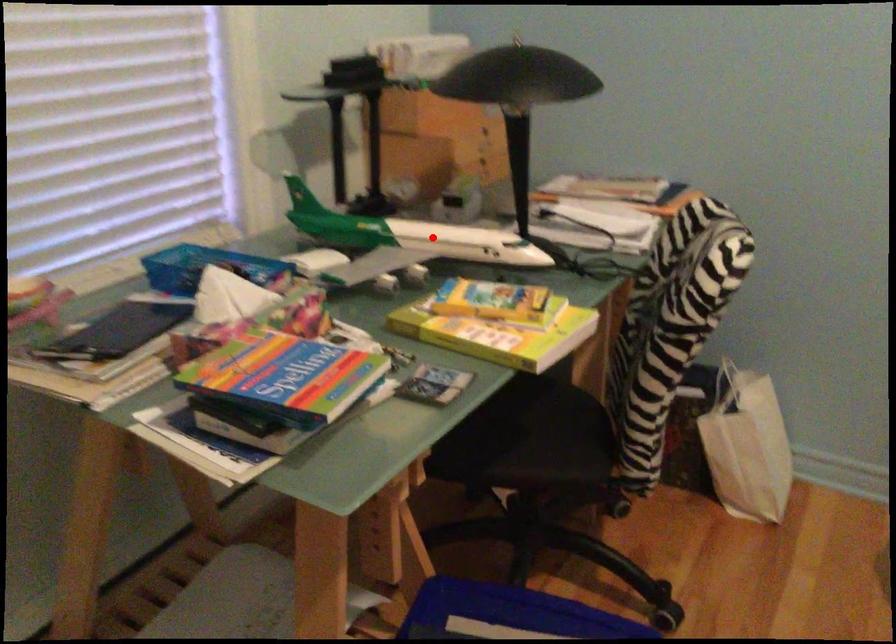
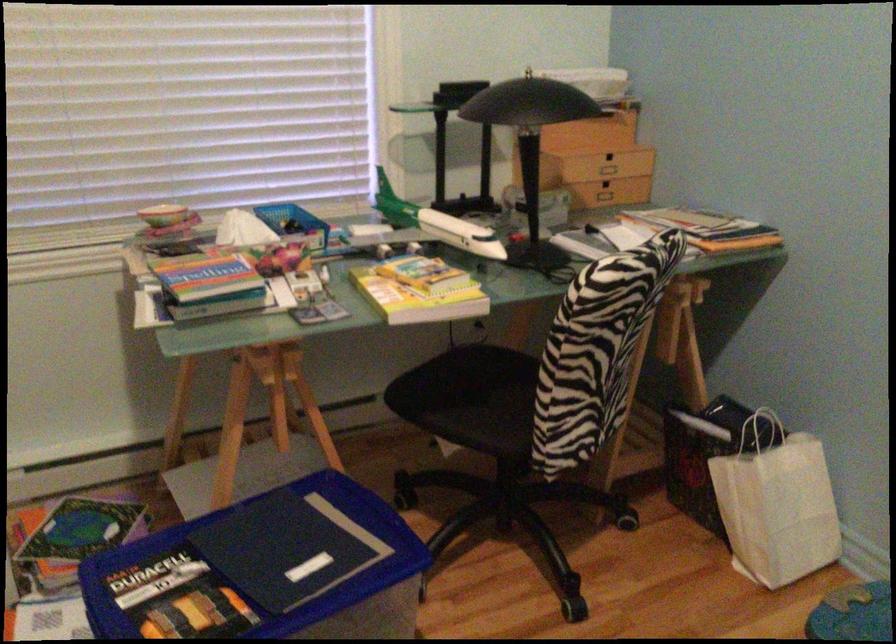
Question: I am providing you with two images of the same scene from different viewpoints. Image1 has a red point marked. In image2, the corresponding 3D location appears at what relative position? Reply with the corresponding letter.

Choices:
 (A) Closer
 (B) Farther

Answer: (B)